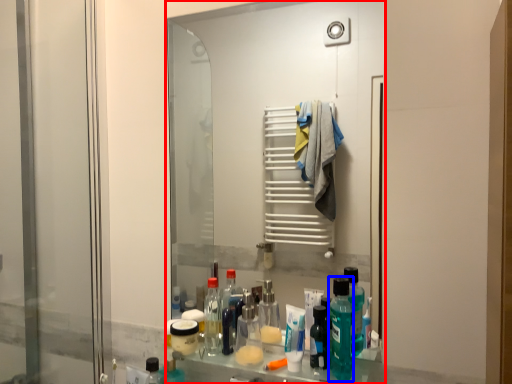
Question: Among these objects, which one is nearest to the camera, mirror (highlighted by a red box) or cleaning product (highlighted by a blue box)?

Choices:
 (A) mirror
 (B) cleaning product

Answer: (B)